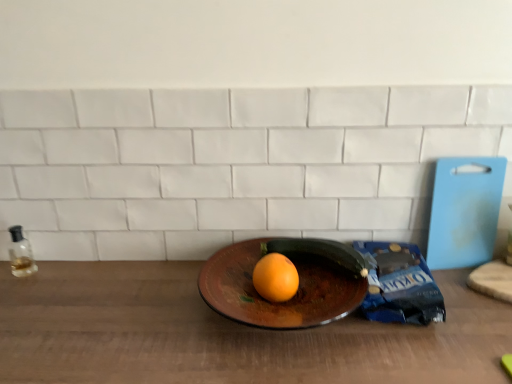
Question: Is orange matte at center taller or shorter than transparent glass bottle at left?

Choices:
 (A) tall
 (B) short

Answer: (B)

Question: From the image's perspective, is orange matte at center positioned above or below transparent glass bottle at left?

Choices:
 (A) above
 (B) below

Answer: (B)

Question: Which is farther from the shiny brown plate at center?

Choices:
 (A) transparent glass bottle at left
 (B) orange matte at center
 (C) green matte zucchini at center

Answer: (A)

Question: Based on their relative distances, which object is nearer to the green matte zucchini at center?

Choices:
 (A) transparent glass bottle at left
 (B) orange matte at center
 (C) shiny brown plate at center

Answer: (C)